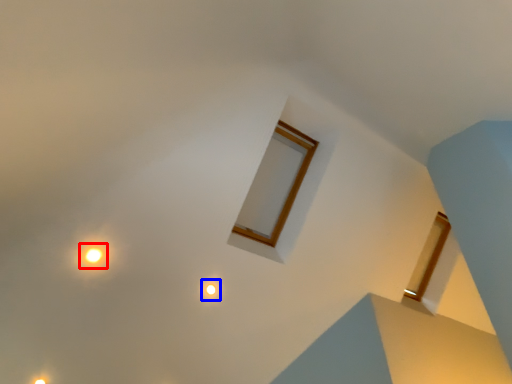
Question: Which object appears closest to the camera in this image, light (highlighted by a red box) or light (highlighted by a blue box)?

Choices:
 (A) light
 (B) light

Answer: (A)